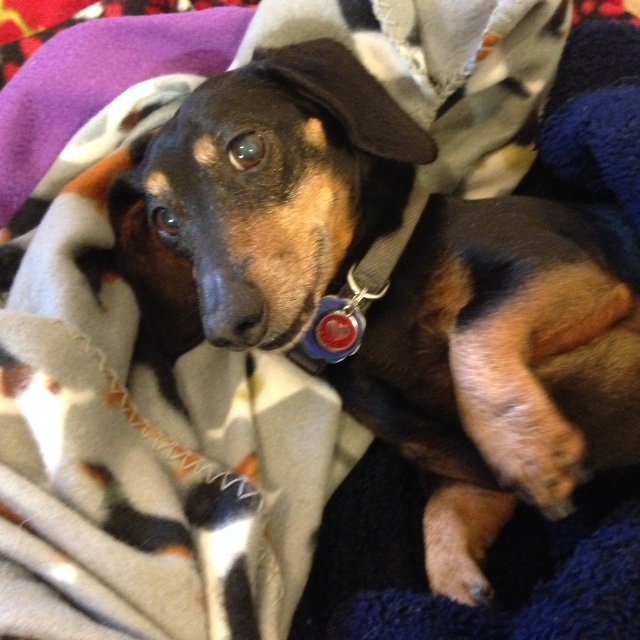
Where is `blanket`? The image size is (640, 640). blanket is located at coordinates (82, 412).